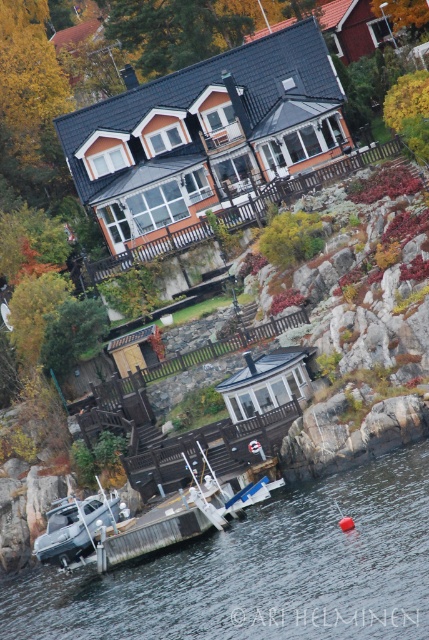
Does point (199, 566) lie behind point (82, 554)?

That is False.

Is clear water at lower center further to the viewer compared to white plastic boat at lower center?

No, it is in front of white plastic boat at lower center.

Does point (199, 618) lie in front of point (108, 522)?

Yes, point (199, 618) is closer to viewer.

The width and height of the screenshot is (429, 640). In order to click on clear water at lower center in this screenshot , I will do `click(260, 572)`.